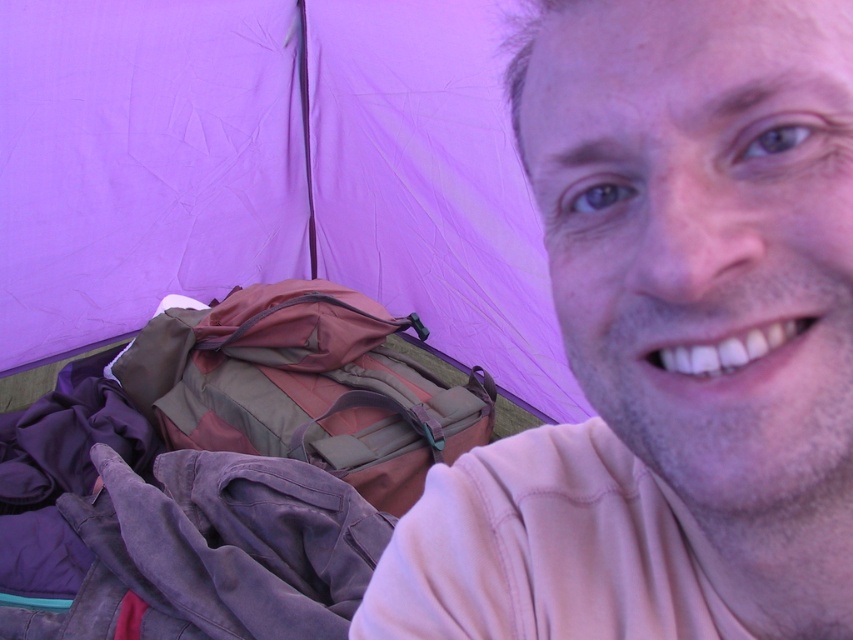
Between pink fabric at upper right and multicolored fabric backpack at center, which one appears on the right side from the viewer's perspective?

Positioned to the right is pink fabric at upper right.

Between point (830, 36) and point (312, 340), which one is positioned in front?

Point (830, 36) is in front.

Describe the element at coordinates (666, 346) in the screenshot. The image size is (853, 640). I see `pink fabric at upper right` at that location.

Where is `pink fabric at upper right`? The height and width of the screenshot is (640, 853). pink fabric at upper right is located at coordinates (666, 346).

Does pink fabric at upper right appear over purple fabric tent at center?

Actually, pink fabric at upper right is below purple fabric tent at center.

Between point (616, 234) and point (300, 144), which one is positioned in front?

Point (616, 234) is more forward.

Where is `pink fabric at upper right`? The image size is (853, 640). pink fabric at upper right is located at coordinates (666, 346).

Is purple fabric tent at center to the left of multicolored fabric backpack at center from the viewer's perspective?

Incorrect, purple fabric tent at center is not on the left side of multicolored fabric backpack at center.

Which is below, purple fabric tent at center or multicolored fabric backpack at center?

multicolored fabric backpack at center is lower down.

Measure the distance between point (x=61, y=97) and camera.

A distance of 5.76 feet exists between point (x=61, y=97) and camera.

Locate an element on the screen. purple fabric tent at center is located at coordinates (270, 172).